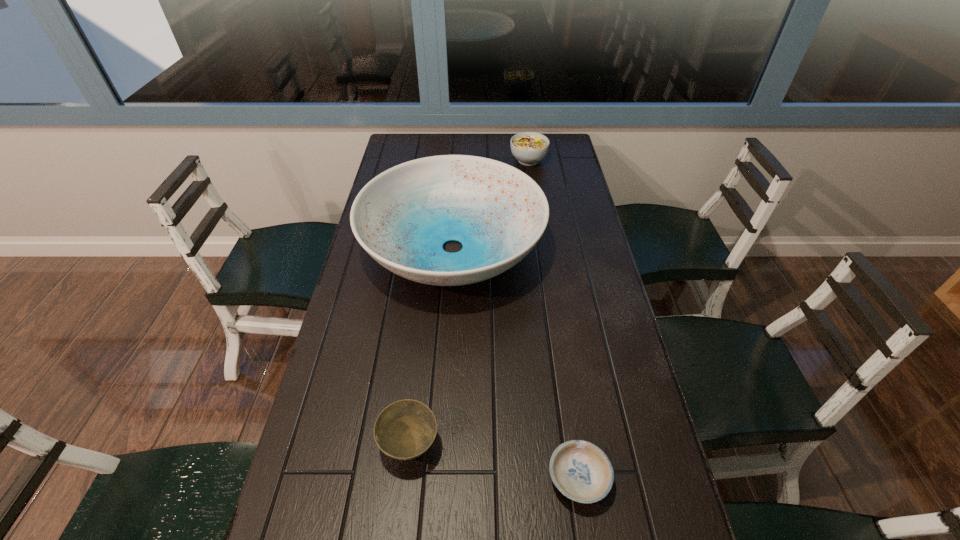
You are a GUI agent. You are given a task and a screenshot of the screen. Output one action in this format:
    pyautogui.click(x=<x>, y=<y>)
    Task: Click on the object at the far edge
    This screenshot has height=540, width=960.
    Given the screenshot: What is the action you would take?
    pyautogui.click(x=529, y=148)

Locate an element on the screen. This screenshot has width=960, height=540. dish that is at the left edge is located at coordinates (402, 218).

Where is `bowl at the left edge`? The image size is (960, 540). bowl at the left edge is located at coordinates (406, 429).

Find the location of a particular element. soup bowl that is at the right edge is located at coordinates (529, 148).

Find the location of a particular element. bowl located in the right edge section of the desktop is located at coordinates (581, 471).

Image resolution: width=960 pixels, height=540 pixels. In order to click on object located at the far right corner in this screenshot , I will do click(529, 148).

Image resolution: width=960 pixels, height=540 pixels. Find the location of `vacant position at the far edge of the desktop`. vacant position at the far edge of the desktop is located at coordinates (468, 133).

You are a GUI agent. You are given a task and a screenshot of the screen. Output one action in this format:
    pyautogui.click(x=<x>, y=<y>)
    Task: Click on the vacant space at the left edge of the desktop
    This screenshot has height=540, width=960.
    Given the screenshot: What is the action you would take?
    pyautogui.click(x=377, y=458)

I want to click on free region at the right edge, so click(558, 301).

Image resolution: width=960 pixels, height=540 pixels. In order to click on vacant area at the far left corner in this screenshot , I will do `click(414, 151)`.